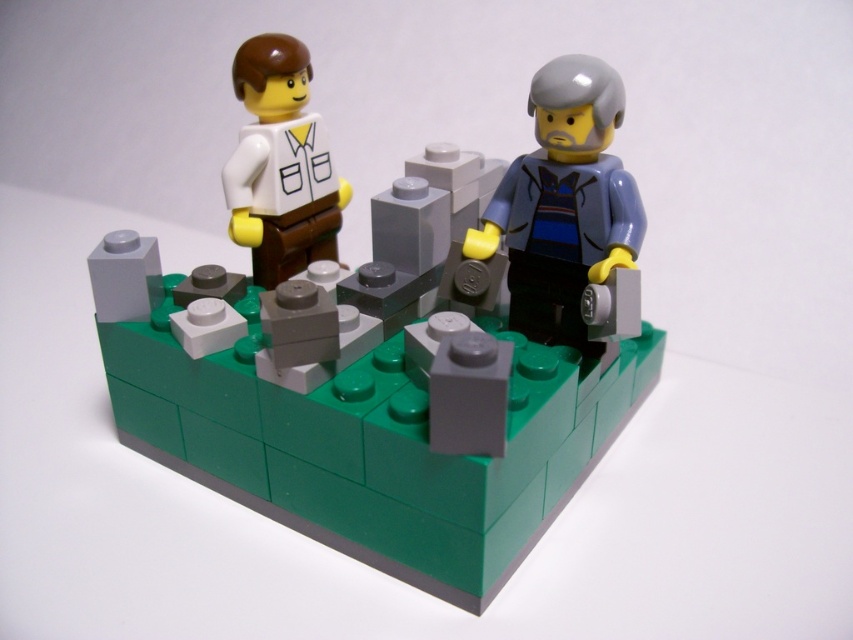
Question: Does matte white shirt at upper center have a lesser width compared to matte gray minifigure at center right?

Choices:
 (A) no
 (B) yes

Answer: (A)

Question: Is matte gray minifigure at center right above matte white shirt at upper left?

Choices:
 (A) no
 (B) yes

Answer: (A)

Question: Can you confirm if matte gray minifigure at center right is thinner than matte white shirt at upper left?

Choices:
 (A) yes
 (B) no

Answer: (B)

Question: Which of the following is the farthest from the observer?

Choices:
 (A) matte gray minifigure at center right
 (B) matte white shirt at upper left

Answer: (B)

Question: Among these objects, which one is nearest to the camera?

Choices:
 (A) matte white shirt at upper left
 (B) matte gray minifigure at center right
 (C) matte white shirt at upper center

Answer: (C)

Question: Which point is closer to the camera?

Choices:
 (A) (511, 548)
 (B) (511, 252)
 (C) (242, 164)

Answer: (A)